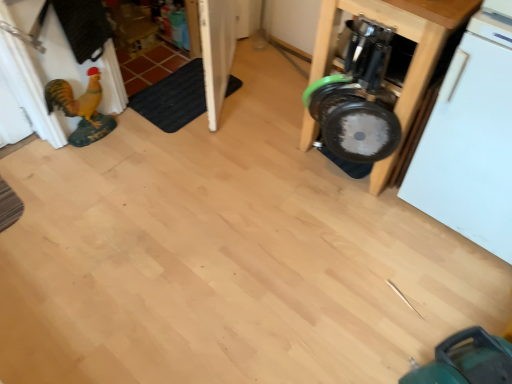
Measure the distance between black rubber mat at lower left and camera.

black rubber mat at lower left and camera are 6.97 feet apart from each other.

Where is `white matte dishwasher at right`? The height and width of the screenshot is (384, 512). white matte dishwasher at right is located at coordinates (470, 141).

Identify the location of metallic silver dumbbell at right. (400, 35).

Where is `black rubber mat at lower left`? black rubber mat at lower left is located at coordinates (173, 98).

Locate an element on the screen. mat that appears behind the metallic silver dumbbell at right is located at coordinates (173, 98).

Measure the distance between metallic silver dumbbell at right and black rubber mat at lower left.

The distance of metallic silver dumbbell at right from black rubber mat at lower left is 93.31 centimeters.

Which is closer, (x=396, y=2) or (x=228, y=89)?

Point (x=396, y=2) is closer to the camera than point (x=228, y=89).

Is white matte dishwasher at right further to camera compared to metallic silver dumbbell at right?

No, it is not.

Looking at this image, from a real-world perspective, which is physically below, white matte dishwasher at right or metallic silver dumbbell at right?

metallic silver dumbbell at right is physically lower.

Is white matte dishwasher at right shorter than metallic silver dumbbell at right?

In fact, white matte dishwasher at right may be taller than metallic silver dumbbell at right.

Is black rubber mat at lower left positioned far away from white matte dishwasher at right?

Yes, black rubber mat at lower left and white matte dishwasher at right are located far from each other.

Considering the sizes of objects black rubber mat at lower left and white matte dishwasher at right in the image provided, who is taller, black rubber mat at lower left or white matte dishwasher at right?

Standing taller between the two is white matte dishwasher at right.

From the image's perspective, is black rubber mat at lower left over white matte dishwasher at right?

Yes, from the image's perspective, black rubber mat at lower left is on top of white matte dishwasher at right.

Does metallic silver dumbbell at right come behind white matte dishwasher at right?

Yes, it is.

At what (x,y) coordinates should I click in order to perform the action: click on furniture below the white matte dishwasher at right (from a real-world perspective). Please return your answer as a coordinate pair (x, y). Looking at the image, I should click on (400, 35).

How many degrees apart are the facing directions of metallic silver dumbbell at right and white matte dishwasher at right?

0.000354 degrees separate the facing orientations of metallic silver dumbbell at right and white matte dishwasher at right.

Choose the correct answer: Is metallic silver dumbbell at right inside white matte dishwasher at right or outside it?

metallic silver dumbbell at right cannot be found inside white matte dishwasher at right.

How many degrees apart are the facing directions of black rubber mat at lower left and metallic silver dumbbell at right?

They differ by 90.7 degrees in their facing directions.

Are black rubber mat at lower left and metallic silver dumbbell at right making contact?

No, black rubber mat at lower left is not making contact with metallic silver dumbbell at right.

Can metallic silver dumbbell at right be found inside black rubber mat at lower left?

No, metallic silver dumbbell at right is not inside black rubber mat at lower left.

Is white matte dishwasher at right in front of or behind black rubber mat at lower left in the image?

white matte dishwasher at right is positioned closer to the viewer than black rubber mat at lower left.

From the picture: Which of these two, white matte dishwasher at right or black rubber mat at lower left, is smaller?

With smaller size is black rubber mat at lower left.

Does white matte dishwasher at right have a lesser width compared to black rubber mat at lower left?

No, white matte dishwasher at right is not thinner than black rubber mat at lower left.

At what (x,y) coordinates should I click in order to perform the action: click on mat on the left side of metallic silver dumbbell at right. Please return your answer as a coordinate pair (x, y). The width and height of the screenshot is (512, 384). Looking at the image, I should click on (173, 98).

You are a GUI agent. You are given a task and a screenshot of the screen. Output one action in this format:
    pyautogui.click(x=<x>, y=<y>)
    Task: Click on the dish washer on the right of metallic silver dumbbell at right
    The image size is (512, 384).
    Given the screenshot: What is the action you would take?
    tap(470, 141)

Based on the photo, considering their positions, is white matte dishwasher at right positioned further to black rubber mat at lower left than metallic silver dumbbell at right?

Based on the image, white matte dishwasher at right appears to be further to black rubber mat at lower left.

Estimate the real-world distances between objects in this image. Which object is further from metallic silver dumbbell at right, black rubber mat at lower left or white matte dishwasher at right?

Among the two, black rubber mat at lower left is located further to metallic silver dumbbell at right.

Estimate the real-world distances between objects in this image. Which object is closer to white matte dishwasher at right, black rubber mat at lower left or metallic silver dumbbell at right?

metallic silver dumbbell at right is positioned closer to the anchor white matte dishwasher at right.

Estimate the real-world distances between objects in this image. Which object is further from white matte dishwasher at right, metallic silver dumbbell at right or black rubber mat at lower left?

black rubber mat at lower left is positioned further to the anchor white matte dishwasher at right.

Based on their spatial positions, is white matte dishwasher at right or black rubber mat at lower left further from metallic silver dumbbell at right?

black rubber mat at lower left lies further to metallic silver dumbbell at right than the other object.

Based on their spatial positions, is metallic silver dumbbell at right or white matte dishwasher at right further from black rubber mat at lower left?

Based on the image, white matte dishwasher at right appears to be further to black rubber mat at lower left.

At what (x,y) coordinates should I click in order to perform the action: click on furniture between black rubber mat at lower left and white matte dishwasher at right. Please return your answer as a coordinate pair (x, y). The image size is (512, 384). Looking at the image, I should click on (400, 35).